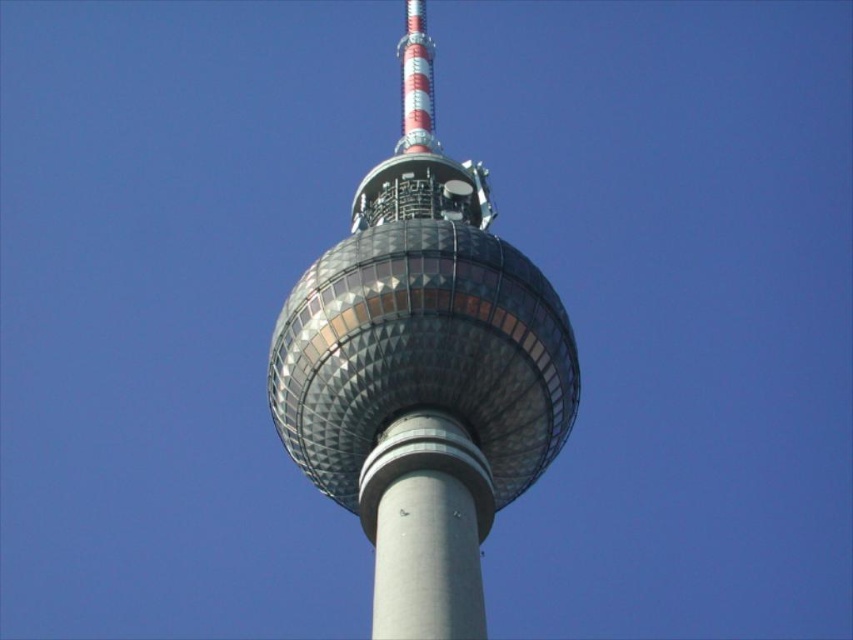
Question: Which point is farther from the camera taking this photo?

Choices:
 (A) (399, 195)
 (B) (381, 579)

Answer: (A)

Question: Does shiny glass sphere at center have a smaller size compared to gray concrete pole at center?

Choices:
 (A) no
 (B) yes

Answer: (A)

Question: Is shiny glass sphere at center above gray concrete pole at center?

Choices:
 (A) no
 (B) yes

Answer: (B)

Question: Considering the relative positions of shiny glass sphere at center and gray concrete pole at center in the image provided, where is shiny glass sphere at center located with respect to gray concrete pole at center?

Choices:
 (A) right
 (B) left

Answer: (B)

Question: Which object appears farthest from the camera in this image?

Choices:
 (A) gray concrete pole at center
 (B) shiny glass sphere at center

Answer: (B)

Question: Which object is closer to the camera taking this photo?

Choices:
 (A) shiny glass sphere at center
 (B) gray concrete pole at center

Answer: (B)